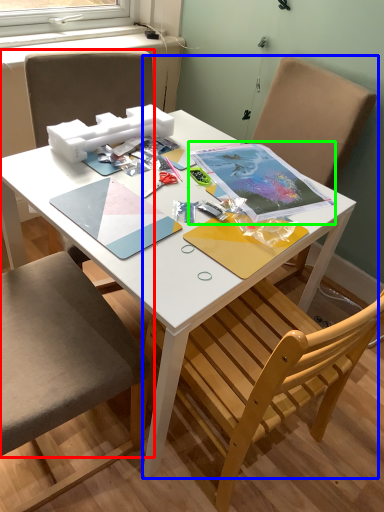
Question: Based on their relative distances, which object is nearer to chair (highlighted by a red box)? Choose from chair (highlighted by a blue box) and notebook (highlighted by a green box).

Choices:
 (A) chair
 (B) notebook

Answer: (B)